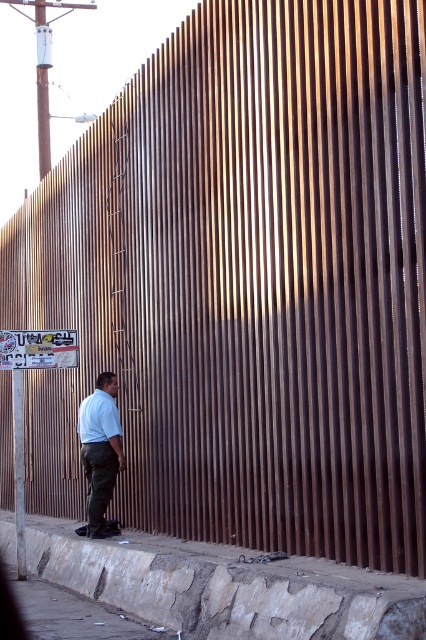
Question: Estimate the real-world distances between objects in this image. Which object is farther from the metallic gray pole at upper left?

Choices:
 (A) light blue shirt at center
 (B) metallic pole at left
 (C) white matte shirt at lower left

Answer: (A)

Question: Among these objects, which one is farthest from the camera?

Choices:
 (A) gray concrete pavement at lower left
 (B) light blue shirt at center

Answer: (B)

Question: Can you confirm if brown stone curb at lower left is bigger than light blue shirt at center?

Choices:
 (A) no
 (B) yes

Answer: (A)

Question: Can you confirm if brown stone curb at lower left is positioned to the left of white matte shirt at lower left?

Choices:
 (A) yes
 (B) no

Answer: (B)

Question: Is brown stone curb at lower left wider than white matte shirt at lower left?

Choices:
 (A) no
 (B) yes

Answer: (A)

Question: Which point is farther to the camera?

Choices:
 (A) metallic gray pole at upper left
 (B) metallic pole at left

Answer: (A)